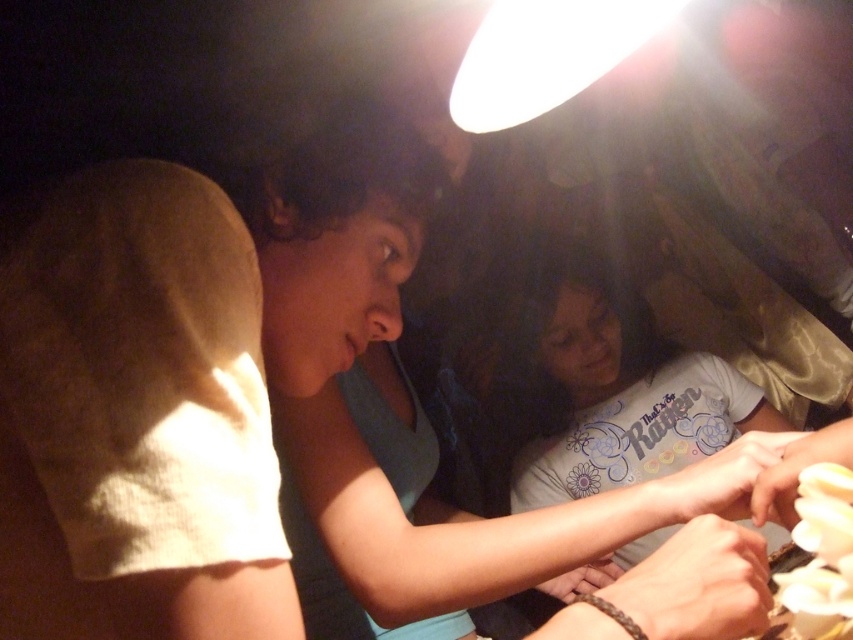
Question: Which object is farther from the camera taking this photo?

Choices:
 (A) brown leather bracelet at lower center
 (B) white glossy food at lower right

Answer: (A)

Question: Which of these objects is positioned closest to the brown leather bracelet at lower center?

Choices:
 (A) white cotton shirt at lower center
 (B) smooth yellow hand at lower right

Answer: (B)

Question: Is white glossy food at lower right below smooth yellow hand at lower right?

Choices:
 (A) no
 (B) yes

Answer: (B)

Question: From the image, what is the correct spatial relationship of white glossy food at lower right in relation to brown woven bracelet at lower center?

Choices:
 (A) below
 (B) above

Answer: (B)

Question: Which object appears farthest from the camera in this image?

Choices:
 (A) smooth yellow hand at lower right
 (B) smooth skin hand at lower right
 (C) white glossy food at lower right
 (D) white cotton shirt at lower center

Answer: (D)

Question: Can you confirm if white cotton shirt at lower center is positioned to the left of white glossy food at lower right?

Choices:
 (A) yes
 (B) no

Answer: (B)